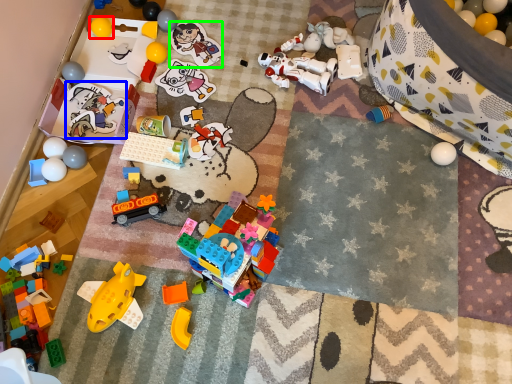
Question: Considering the real-world distances, which object is farthest from toy (highlighted by a red box)? toy (highlighted by a blue box) or toy (highlighted by a green box)?

Choices:
 (A) toy
 (B) toy

Answer: (B)